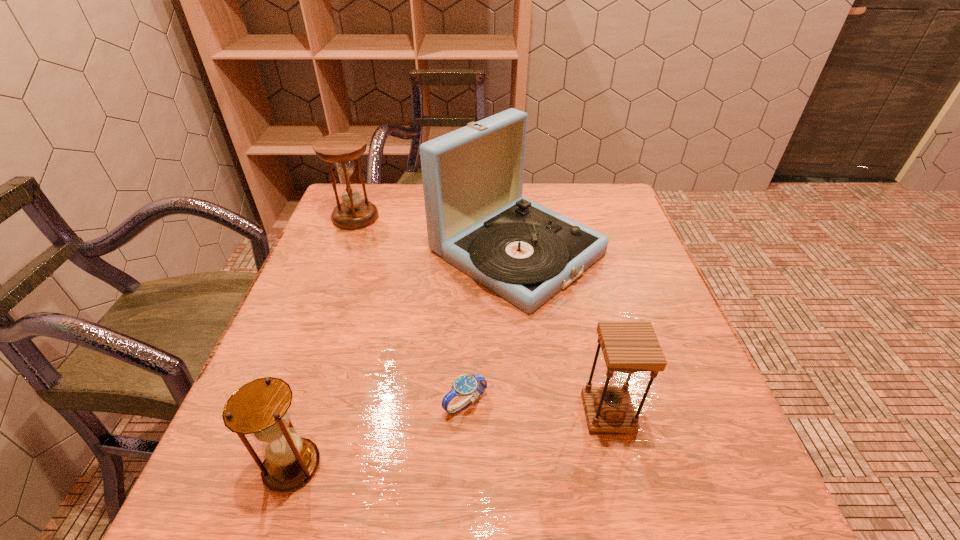
Where is `phonograph record present at the far edge`? The image size is (960, 540). phonograph record present at the far edge is located at coordinates (477, 220).

Where is `hourglass located in the far edge section of the desktop`? The width and height of the screenshot is (960, 540). hourglass located in the far edge section of the desktop is located at coordinates (354, 213).

Identify the location of object situated at the near edge. The image size is (960, 540). (260, 408).

You are a GUI agent. You are given a task and a screenshot of the screen. Output one action in this format:
    pyautogui.click(x=<x>, y=<y>)
    Task: Click on the phonograph record that is at the right edge
    Image resolution: width=960 pixels, height=540 pixels.
    Given the screenshot: What is the action you would take?
    pyautogui.click(x=477, y=220)

Locate an element on the screen. The image size is (960, 540). hourglass that is at the right edge is located at coordinates (x=628, y=347).

Where is `object that is positioned at the far left corner`? The image size is (960, 540). object that is positioned at the far left corner is located at coordinates (354, 213).

You are a GUI agent. You are given a task and a screenshot of the screen. Output one action in this format:
    pyautogui.click(x=<x>, y=<y>)
    Task: Click on the object positioned at the near left corner
    
    Given the screenshot: What is the action you would take?
    pyautogui.click(x=260, y=408)

Locate an element on the screen. This screenshot has width=960, height=540. object at the far right corner is located at coordinates (477, 220).

Locate an element on the screen. The image size is (960, 540). vacant space at the far edge of the desktop is located at coordinates (533, 189).

Where is `vacant space at the near edge of the desktop`? The image size is (960, 540). vacant space at the near edge of the desktop is located at coordinates click(x=543, y=472).